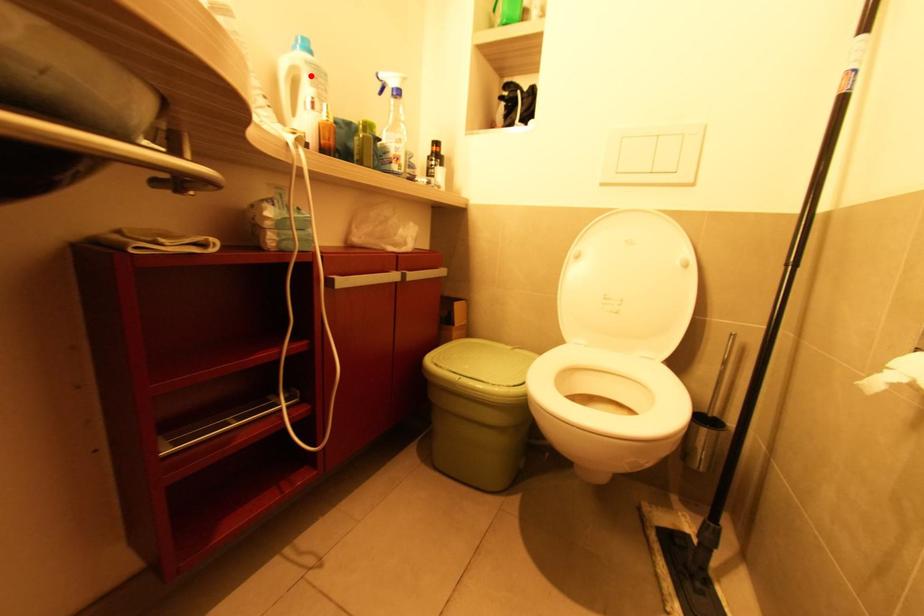
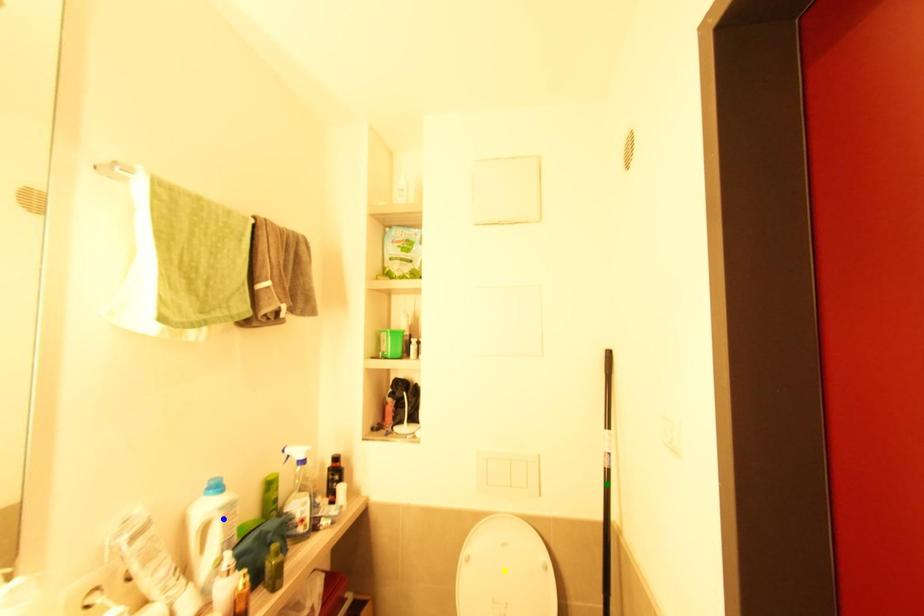
Question: I am providing you with two images of the same scene from different viewpoints. A red point is marked on the first image. You are given multiple points on the second image. Which mark in image 2 goes with the point in image 1?

Choices:
 (A) green point
 (B) blue point
 (C) yellow point

Answer: (B)